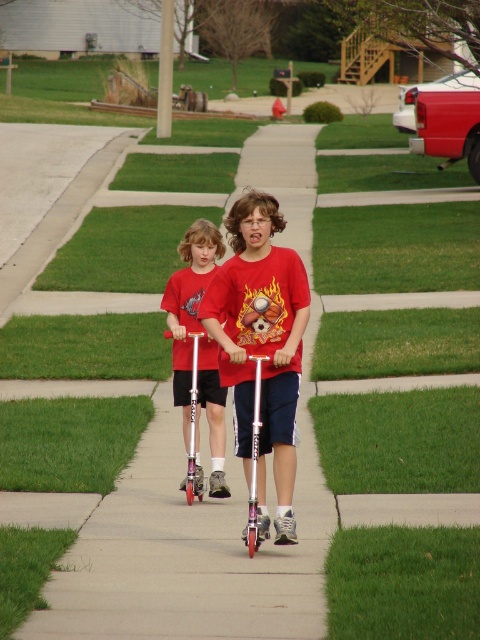
You are a delivery drone flying over a suburban area. You need to land on the smooth concrete sidewalk at center to drop off a package. However, there is a matte red scooter at center in the way. Can the drone safely land on the sidewalk without hitting the scooter?

The smooth concrete sidewalk at center is taller than matte red scooter at center, so the drone can safely land on the sidewalk without hitting the scooter because the sidewalk is elevated above the scooter.

You are standing on the sidewalk and see two points marked on the ground. The first point is at coordinate point(232,602) and the second point is at coordinate point(188,289). Which point is closer to you?

The point at coordinate point(232,602) is closer to you than the point at coordinate point(188,289).